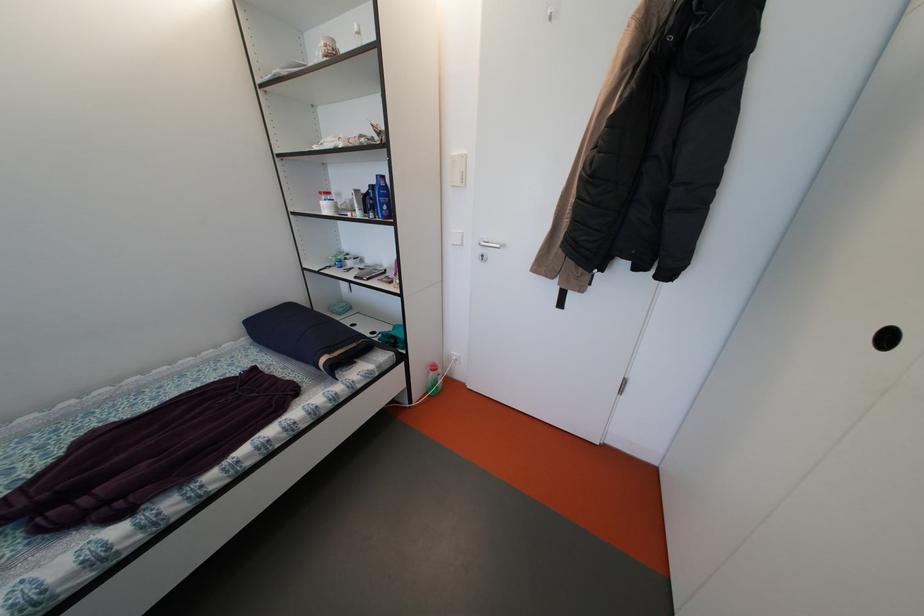
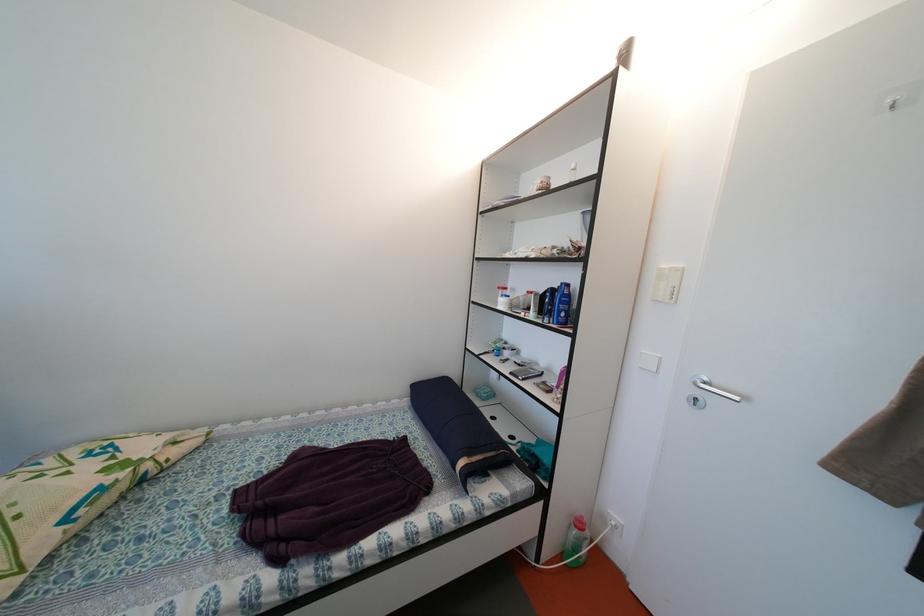
Where in the second image is the point corresponding to point 458,261 from the first image?

(642, 385)